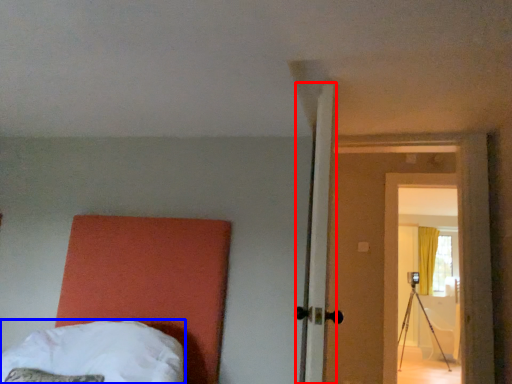
Question: Which object is closer to the camera taking this photo, door (highlighted by a red box) or bed (highlighted by a blue box)?

Choices:
 (A) door
 (B) bed

Answer: (B)